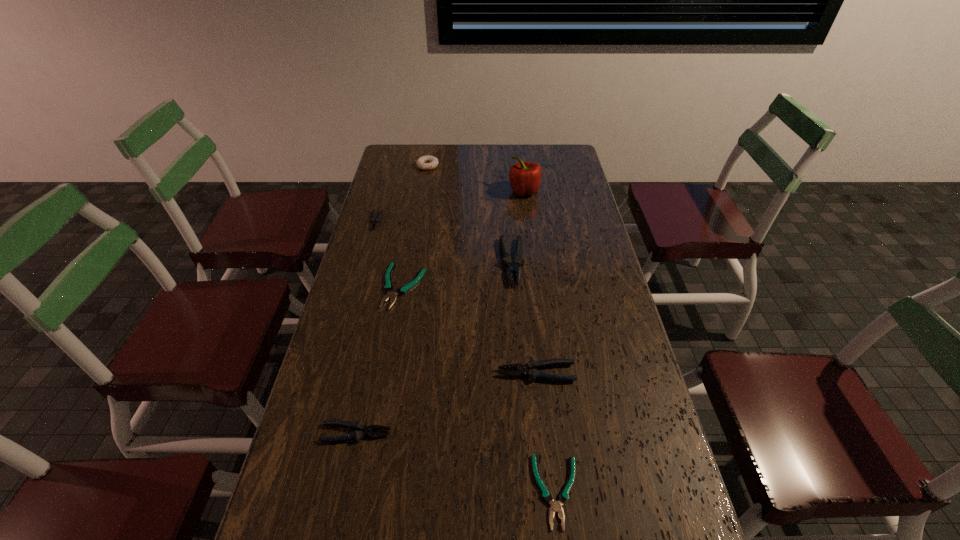
Identify the location of free space in the image that satisfies the following two spatial constraints: 1. on the front side of the white doughnut; 2. on the left side of the bell pepper. (423, 191).